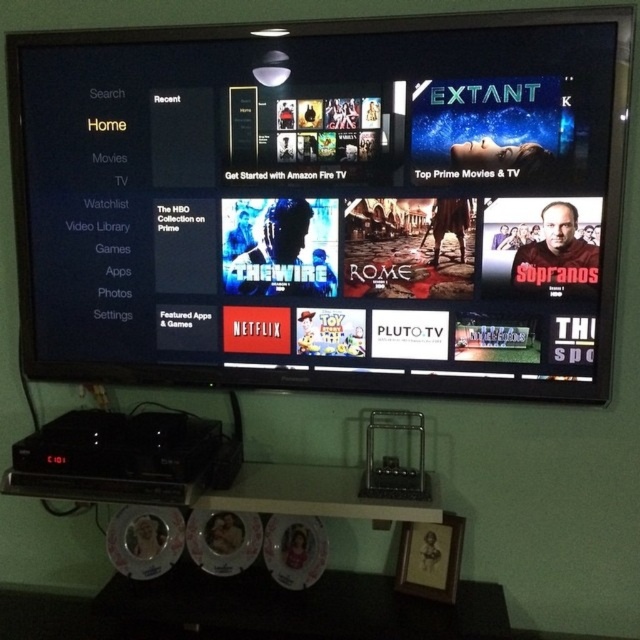
You are using a remote control to navigate the Amazon Fire TV interface. You are currently focused on the point at coordinates point (360, 164). There is another point at point (300, 525). Which point is closer to you?

The point at point (360, 164) is closer to the viewer than point (300, 525).

You are setting up a media center and need to place the black glossy tv at upper center and the white glossy dvd at lower center on a shelf. Given that the shelf has limited vertical space, which object will require more vertical space?

The black glossy tv at upper center requires more vertical space because it is taller than the white glossy dvd at lower center.

You are holding a white glossy dvd at lower center and want to place it on the black glossy tv at upper center. Can you reach it if your arm can extend 25 inches?

The black glossy tv at upper center is 28.71 inches from the white glossy dvd at lower center. Since your arm can only extend 25 inches, you cannot reach it.